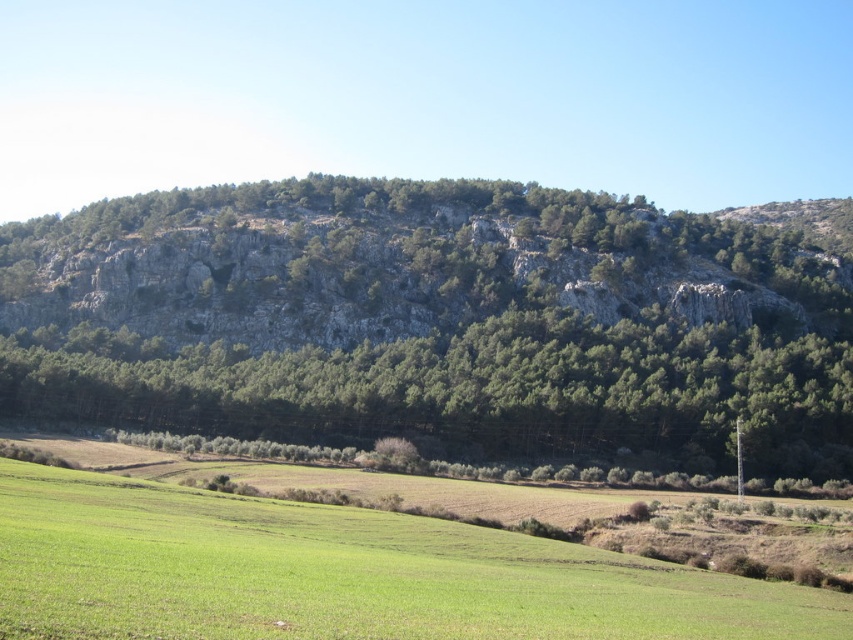
You are a hiker planning to take a photo of the rocky gray mountain at center and the green leafy trees at center. Which object should you focus on first if you want both to be in sharp focus?

The rocky gray mountain at center has a larger size compared to the green leafy trees at center, so you should focus on the larger object first to ensure both are in sharp focus.

In the scene shown: You are standing at the bottom of the hill and looking towards the green leafy trees at center and the green grass pasture at lower left. Which object is higher in elevation?

The green leafy trees at center are higher in elevation than the green grass pasture at lower left because they are positioned above it in the image.

You are standing at the origin point in the image. Where are the green leafy trees at center located?

The green leafy trees at center are located at point 0.613 on the x axis and 0.552 on the y axis.